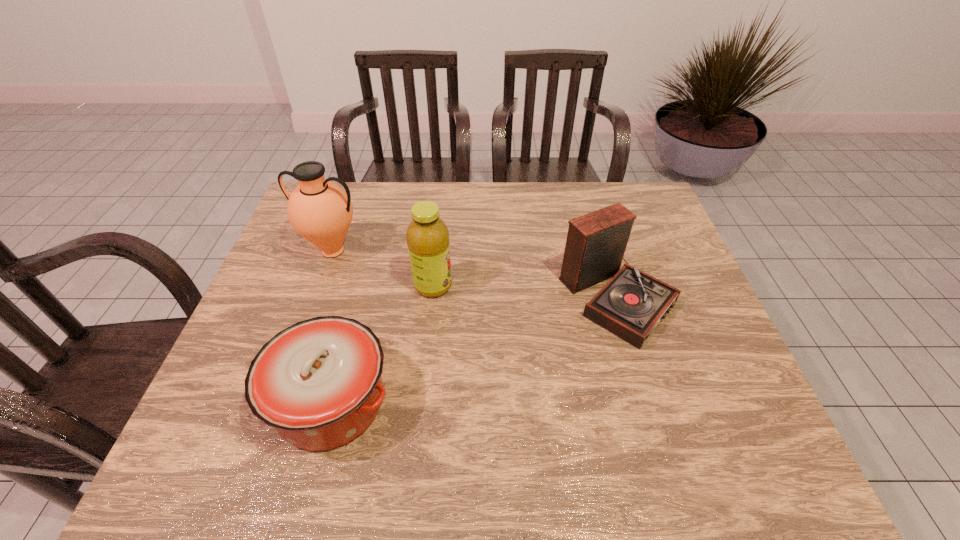
Image resolution: width=960 pixels, height=540 pixels. What are the coordinates of `free space between the casserole and the phonograph record` in the screenshot? It's located at (474, 349).

Identify the location of object that is the closest to the pitcher. (427, 236).

Where is `the second closest object to the third tallest object`? This screenshot has width=960, height=540. the second closest object to the third tallest object is located at coordinates (318, 382).

Find the location of a particular element. The width and height of the screenshot is (960, 540). free space that satisfies the following two spatial constraints: 1. on the front label of the third object from left to right; 2. on the back side of the rightmost object is located at coordinates (432, 298).

Locate an element on the screen. free space that satisfies the following two spatial constraints: 1. on the back side of the third tallest object; 2. on the front label of the third object from left to right is located at coordinates (614, 286).

Identify the location of vacant space that satisfies the following two spatial constraints: 1. on the front label of the rightmost object; 2. on the right side of the third object from left to right. (432, 298).

Image resolution: width=960 pixels, height=540 pixels. Find the location of `vacant area in the image that satisfies the following two spatial constraints: 1. on the front side of the third tallest object; 2. on the right side of the pitcher`. vacant area in the image that satisfies the following two spatial constraints: 1. on the front side of the third tallest object; 2. on the right side of the pitcher is located at coordinates (317, 298).

Identify the location of vacant space that satisfies the following two spatial constraints: 1. on the back side of the nearest object; 2. on the left side of the rightmost object. This screenshot has height=540, width=960. (359, 298).